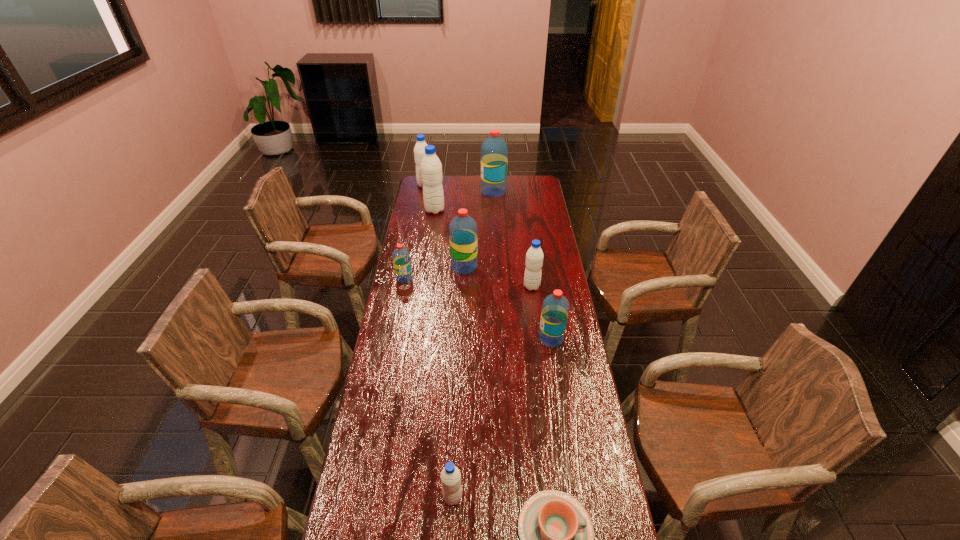
The height and width of the screenshot is (540, 960). I want to click on the smallest red water bottle, so click(401, 258).

What are the coordinates of `the nearest water bottle` in the screenshot? It's located at (450, 476).

You are a GUI agent. You are given a task and a screenshot of the screen. Output one action in this format:
    pyautogui.click(x=<x>, y=<y>)
    Task: Click on the smallest gray water bottle
    The width and height of the screenshot is (960, 540).
    Given the screenshot: What is the action you would take?
    pyautogui.click(x=450, y=476)

The width and height of the screenshot is (960, 540). I want to click on vacant space situated on the front label of the second red water bottle from right to left, so click(x=439, y=192).

This screenshot has width=960, height=540. I want to click on vacant space situated 0.350m on the front label of the second red water bottle from right to left, so click(420, 192).

The width and height of the screenshot is (960, 540). In order to click on free space located 0.340m on the front label of the second red water bottle from right to left in this screenshot , I will do `click(420, 192)`.

The image size is (960, 540). In order to click on vacant space situated on the back of the second farthest gray water bottle in this screenshot , I will do `click(437, 197)`.

Identify the location of free space located 0.280m on the right of the farthest gray water bottle. (481, 185).

Image resolution: width=960 pixels, height=540 pixels. I want to click on vacant space located 0.150m on the front label of the third smallest red water bottle, so click(511, 267).

You are a GUI agent. You are given a task and a screenshot of the screen. Output one action in this format:
    pyautogui.click(x=<x>, y=<y>)
    Task: Click on the vacant region located 0.280m on the left of the second nearest gray water bottle
    This screenshot has width=960, height=540.
    Given the screenshot: What is the action you would take?
    pyautogui.click(x=459, y=287)